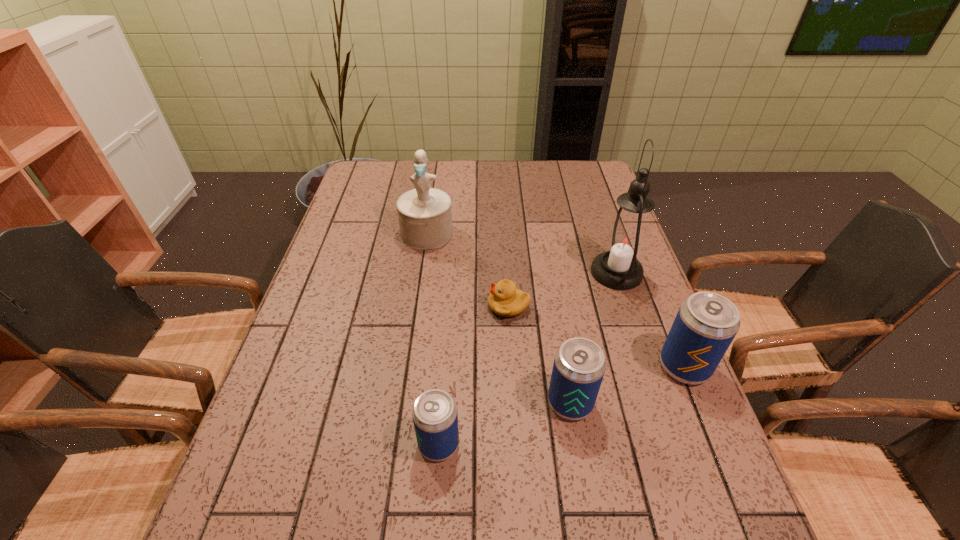
You are a GUI agent. You are given a task and a screenshot of the screen. Output one action in this format:
    pyautogui.click(x=<x>, y=<y>)
    Task: Click on the oil lamp that is at the right edge
    
    Given the screenshot: What is the action you would take?
    pyautogui.click(x=625, y=241)

Locate an element on the screen. This screenshot has width=960, height=540. free region at the far edge of the desktop is located at coordinates (505, 182).

Where is `vacant space at the near edge of the desktop`? This screenshot has height=540, width=960. vacant space at the near edge of the desktop is located at coordinates (405, 492).

Identify the location of vacant space at the left edge of the desktop. (289, 443).

Where is `free location at the right edge`? The height and width of the screenshot is (540, 960). free location at the right edge is located at coordinates (655, 413).

The image size is (960, 540). In order to click on free region at the far right corner in this screenshot , I will do `click(607, 190)`.

What are the coordinates of `free space at the near right corner` in the screenshot? It's located at (707, 467).

Identify the location of vacant space in between the third shortest object and the duckling. (540, 354).

Locate an element on the screen. The image size is (960, 540). empty space between the third shortest object and the third object from left to right is located at coordinates (540, 354).

Where is `vacant area that lies between the rightmost beer can and the tallest object`? This screenshot has width=960, height=540. vacant area that lies between the rightmost beer can and the tallest object is located at coordinates point(650,320).